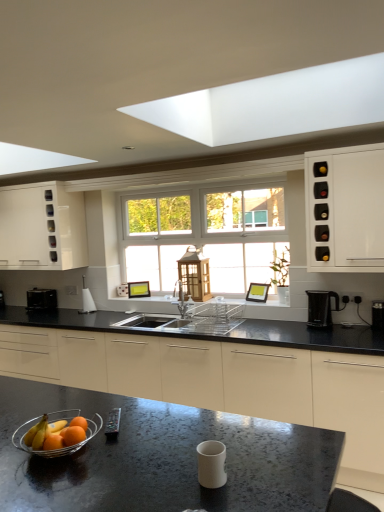
Locate an element on the screen. space that is in front of metallic silver faucet at center is located at coordinates (184, 323).